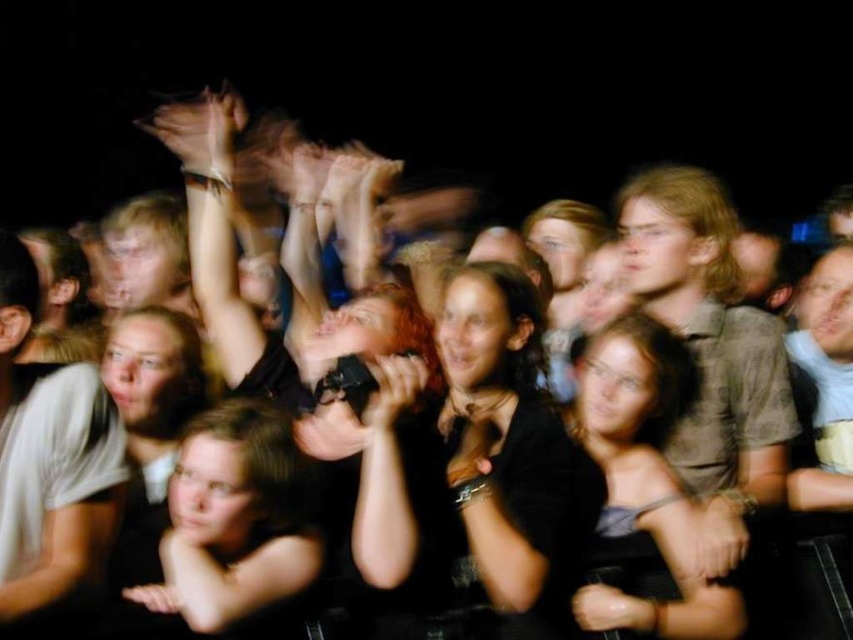
You are a stagehand at the concert and need to ensure that the translucent skin hand at upper center can grasp the black matte microphone at center. Based on their sizes, is this possible?

The black matte microphone at center is wider than the translucent skin hand at upper center, so the hand cannot grasp it properly due to the microphone being too wide.

You are a stagehand at the event and need to place a new spotlight directly above the black matte microphone at center. The spotlight requires a 1.2 meter clearance from the ground to the microphone. Can you confirm if the microphone is within the required height range?

The black matte microphone at center is positioned at point coordinates that do not provide specific height information. Without knowing the vertical axis measurement corresponding to height, it is impossible to determine if the microphone meets the 1.2 meter clearance requirement.

You are a photographer at the concert and want to capture a photo of the black fabric shirt at center and the translucent skin hand at upper center. Which object should you focus on first if you want to ensure both are in focus without adjusting the camera settings?

The black fabric shirt at center has a greater height compared to the translucent skin hand at upper center, so focusing on the black fabric shirt at center first would ensure both are in focus since it is taller and likely closer to the camera.